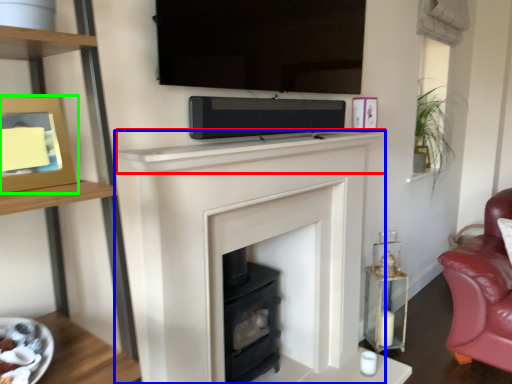
Question: Based on their relative distances, which object is farther from mantle (highlighted by a red box)? Choose from fireplace (highlighted by a blue box) and picture frame (highlighted by a green box).

Choices:
 (A) fireplace
 (B) picture frame

Answer: (B)